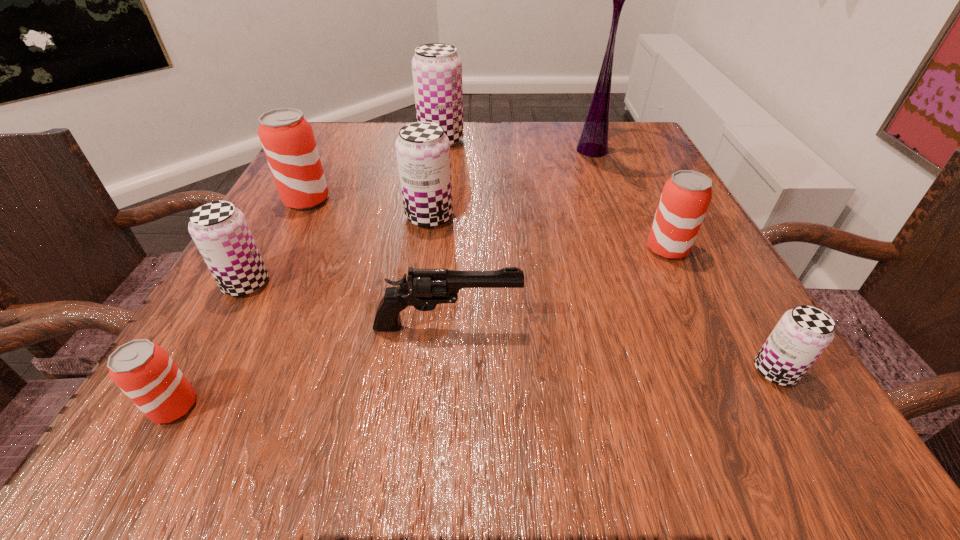
Where is `free location at the near edge`? This screenshot has width=960, height=540. free location at the near edge is located at coordinates (599, 397).

Find the location of `vacant space at the left edge of the desktop`. vacant space at the left edge of the desktop is located at coordinates pos(234,340).

The width and height of the screenshot is (960, 540). Find the location of `free space at the right edge of the desktop`. free space at the right edge of the desktop is located at coordinates (685, 264).

In order to click on vacant space at the far left corner of the desktop in this screenshot , I will do `click(368, 157)`.

You are a GUI agent. You are given a task and a screenshot of the screen. Output one action in this format:
    pyautogui.click(x=<x>, y=<y>)
    Task: Click on the vacant space at the near left corner of the desktop
    This screenshot has width=960, height=540.
    Given the screenshot: What is the action you would take?
    [x=230, y=436]

Where is `free space at the far right corner`? The image size is (960, 540). free space at the far right corner is located at coordinates (609, 152).

You are a GUI agent. You are given a task and a screenshot of the screen. Output one action in this format:
    pyautogui.click(x=<x>, y=<y>)
    Task: Click on the vacant area that lies between the lampshade and the second smallest orange beer can
    This screenshot has width=960, height=540.
    Given the screenshot: What is the action you would take?
    point(630,199)

This screenshot has height=540, width=960. I want to click on vacant region between the smallest purple beer can and the second farthest orange beer can, so click(x=721, y=310).

I want to click on vacant space that is in between the third smallest purple beer can and the sixth farthest object, so click(338, 250).

This screenshot has width=960, height=540. Identify the location of vacant space in between the nearest purple beer can and the second smallest purple beer can. (511, 327).